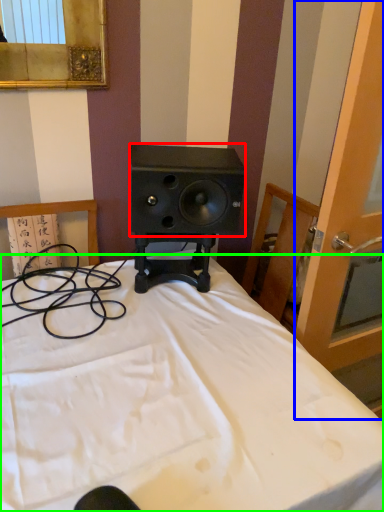
Question: Estimate the real-world distances between objects in this image. Which object is closer to speaker (highlighted by a red box), screen door (highlighted by a blue box) or bed (highlighted by a green box)?

Choices:
 (A) screen door
 (B) bed

Answer: (A)